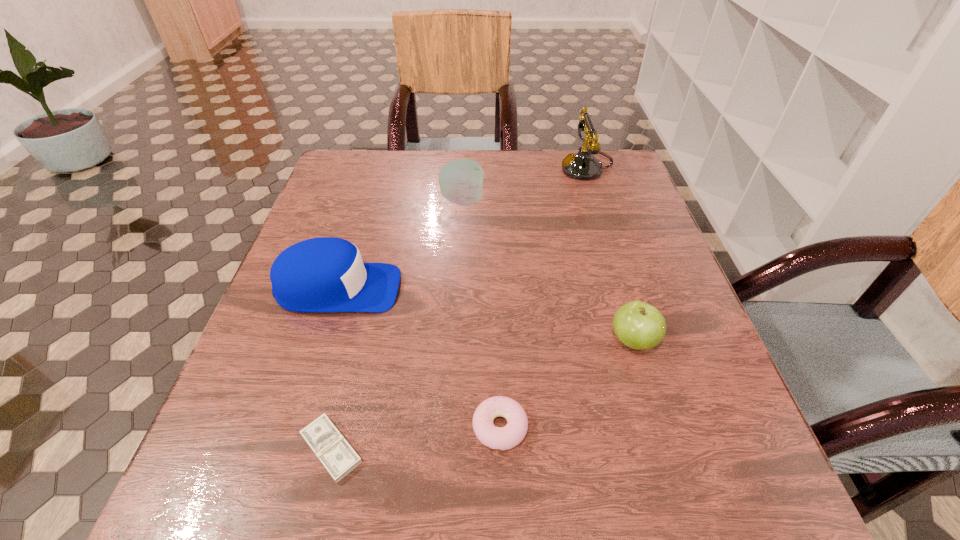
Where is `vacant point located 0.200m on the left of the left apple`? vacant point located 0.200m on the left of the left apple is located at coordinates (362, 201).

Locate an element on the screen. vacant region located 0.060m on the front-facing side of the third farthest object is located at coordinates (429, 288).

Image resolution: width=960 pixels, height=540 pixels. I want to click on free space located on the left of the nearer apple, so click(x=483, y=341).

The width and height of the screenshot is (960, 540). Find the location of `free location located 0.090m on the front of the doughnut`. free location located 0.090m on the front of the doughnut is located at coordinates (503, 519).

This screenshot has width=960, height=540. Find the location of `vacant space located 0.080m on the back of the shortest object`. vacant space located 0.080m on the back of the shortest object is located at coordinates 349,374.

You are a GUI agent. You are given a task and a screenshot of the screen. Output one action in this format:
    pyautogui.click(x=<x>, y=<y>)
    Task: Click on the telephone at the far edge
    Image resolution: width=960 pixels, height=540 pixels.
    Given the screenshot: What is the action you would take?
    pyautogui.click(x=583, y=165)

In order to click on apple that is at the far edge in this screenshot , I will do `click(461, 181)`.

Where is `object present at the near edge`? This screenshot has width=960, height=540. object present at the near edge is located at coordinates (338, 457).

Find the location of a particular element. baseball cap located in the left edge section of the desktop is located at coordinates (326, 274).

The height and width of the screenshot is (540, 960). What are the coordinates of `money at the left edge` in the screenshot? It's located at (338, 457).